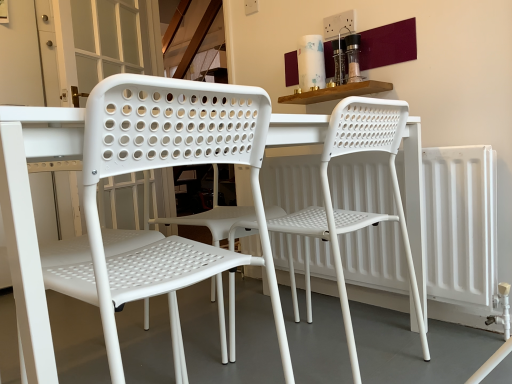
Question: In which direction should I rotate to look at white plastic chair at center, the 1th chair viewed from the right?

Choices:
 (A) right
 (B) left

Answer: (A)

Question: Does white matte radiator at right have a greater width compared to white plastic chair at center, placed as the 2th chair when sorted from left to right?

Choices:
 (A) yes
 (B) no

Answer: (B)

Question: Can you confirm if white matte radiator at right is positioned to the right of white plastic chair at center, placed as the 2th chair when sorted from left to right?

Choices:
 (A) no
 (B) yes

Answer: (B)

Question: Considering the relative sizes of white matte radiator at right and white plastic chair at center, the 1th chair viewed from the right, in the image provided, is white matte radiator at right thinner than white plastic chair at center, the 1th chair viewed from the right,?

Choices:
 (A) no
 (B) yes

Answer: (B)

Question: Is white plastic chair at center, placed as the 2th chair when sorted from left to right, at the back of white matte radiator at right?

Choices:
 (A) yes
 (B) no

Answer: (A)

Question: From a real-world perspective, is white matte radiator at right on white plastic chair at center, the 1th chair viewed from the right?

Choices:
 (A) yes
 (B) no

Answer: (B)

Question: Could white plastic chair at center, the 1th chair viewed from the right, be considered to be inside white matte radiator at right?

Choices:
 (A) no
 (B) yes

Answer: (A)

Question: Considering the relative sizes of white matte radiator at right and white plastic chair at center, which is the 2th chair from right to left, in the image provided, is white matte radiator at right taller than white plastic chair at center, which is the 2th chair from right to left,?

Choices:
 (A) yes
 (B) no

Answer: (B)

Question: Could white plastic chair at center, which is the 2th chair from right to left, be considered to be inside white matte radiator at right?

Choices:
 (A) no
 (B) yes

Answer: (A)

Question: Does white matte radiator at right have a smaller size compared to white plastic chair at center, which is the 2th chair from right to left?

Choices:
 (A) no
 (B) yes

Answer: (B)

Question: From a real-world perspective, is white matte radiator at right over white plastic chair at center, which is the 2th chair from right to left?

Choices:
 (A) no
 (B) yes

Answer: (A)

Question: Does white matte radiator at right lie behind white plastic chair at center, which is the 2th chair from right to left?

Choices:
 (A) no
 (B) yes

Answer: (B)

Question: Considering the relative sizes of white matte radiator at right and white plastic chair at center, marked as the 1th chair in a left-to-right arrangement, in the image provided, is white matte radiator at right thinner than white plastic chair at center, marked as the 1th chair in a left-to-right arrangement,?

Choices:
 (A) no
 (B) yes

Answer: (B)

Question: Does white plastic chair at center, placed as the 2th chair when sorted from left to right, appear on the left side of white plastic chair at center, which is the 2th chair from right to left?

Choices:
 (A) no
 (B) yes

Answer: (A)